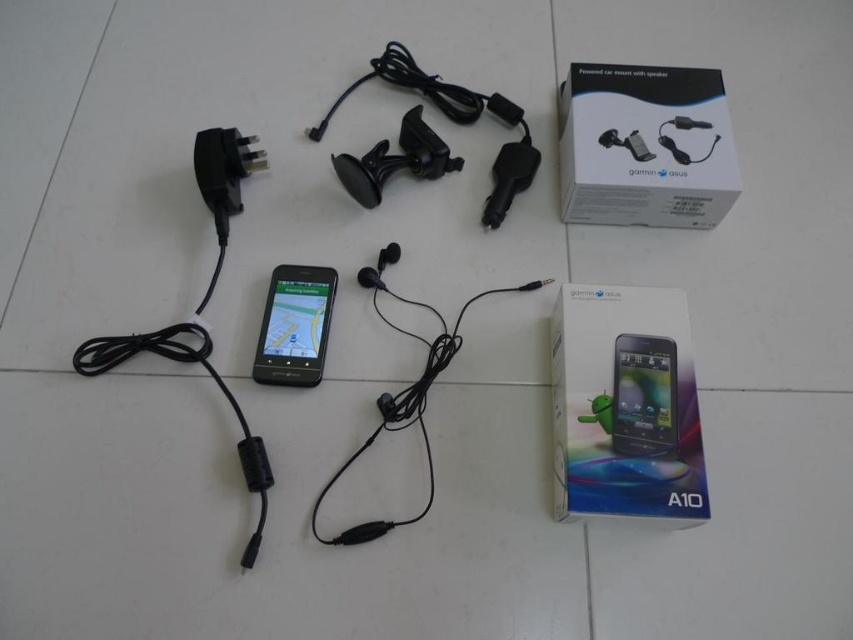
The height and width of the screenshot is (640, 853). In order to click on black glossy phone at center in this screenshot , I will do `click(294, 324)`.

Who is shorter, black glossy phone at center or matte black phone at center?

matte black phone at center

Is point (283, 289) farther from camera compared to point (624, 397)?

Yes, point (283, 289) is behind point (624, 397).

Locate an element on the screen. black glossy phone at center is located at coordinates (294, 324).

Does metallic blue smartphone box at center have a lesser width compared to white matte box at upper right?

Yes.

Who is shorter, metallic blue smartphone box at center or white matte box at upper right?

white matte box at upper right

Between point (564, 368) and point (704, 138), which one is positioned in front?

Positioned in front is point (564, 368).

Locate an element on the screen. Image resolution: width=853 pixels, height=640 pixels. metallic blue smartphone box at center is located at coordinates (625, 404).

How much distance is there between white matte box at upper right and matte black phone at center?

white matte box at upper right is 12.95 inches from matte black phone at center.

In order to click on white matte box at upper right in this screenshot , I will do point(645,147).

Locate an element on the screen. Image resolution: width=853 pixels, height=640 pixels. white matte box at upper right is located at coordinates (645, 147).